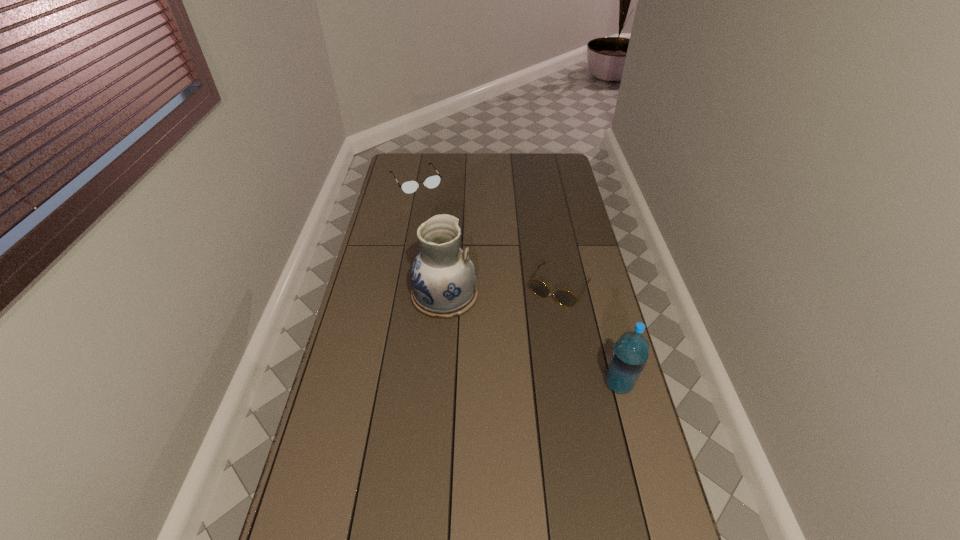
Identify the location of pottery. The image size is (960, 540). (443, 278).

This screenshot has height=540, width=960. I want to click on the second tallest object, so (630, 353).

Locate an element on the screen. This screenshot has height=540, width=960. water bottle is located at coordinates (630, 353).

You are a GUI agent. You are given a task and a screenshot of the screen. Output one action in this format:
    pyautogui.click(x=<x>, y=<y>)
    Task: Click on the farthest object
    
    Given the screenshot: What is the action you would take?
    pyautogui.click(x=431, y=182)

Where is `sunglasses`? sunglasses is located at coordinates (564, 297).

In order to click on blank space located 0.110m on the left of the pottery in this screenshot , I will do `click(381, 295)`.

Identify the location of free spot located 0.140m on the front of the water bottle. (635, 443).

Identify the location of vacant position located 0.160m on the lenses of the spectacles. (436, 213).

The height and width of the screenshot is (540, 960). Identify the location of vacant space situated 0.170m on the lenses of the spectacles. (436, 214).

Find the location of `free spot located 0.260m on the lenses of the spectacles`. free spot located 0.260m on the lenses of the spectacles is located at coordinates (443, 225).